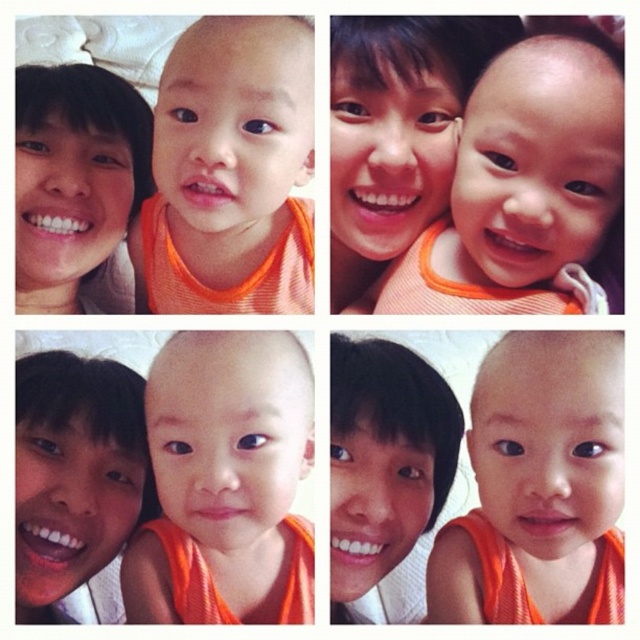
Does smooth orange bib at center appear under matte orange baby at upper center?

Indeed, smooth orange bib at center is positioned under matte orange baby at upper center.

Can you confirm if smooth orange bib at center is positioned to the left of matte orange baby at upper center?

No, smooth orange bib at center is not to the left of matte orange baby at upper center.

Locate an element on the screen. Image resolution: width=640 pixels, height=640 pixels. smooth orange bib at center is located at coordinates (536, 170).

Identify the location of smooth orange bib at center. (536, 170).

Does point (488, 109) come behind point (109, 220)?

No, (488, 109) is closer to viewer.

Find the location of a particular element. This screenshot has width=640, height=640. orange fabric baby at upper right is located at coordinates (520, 186).

Is orange fabric baby at center thinner than matte orange baby at upper center?

No.

Is orange fabric baby at center to the left of matte orange baby at upper center from the viewer's perspective?

Correct, you'll find orange fabric baby at center to the left of matte orange baby at upper center.

Locate an element on the screen. This screenshot has width=640, height=640. orange fabric baby at center is located at coordinates (234, 124).